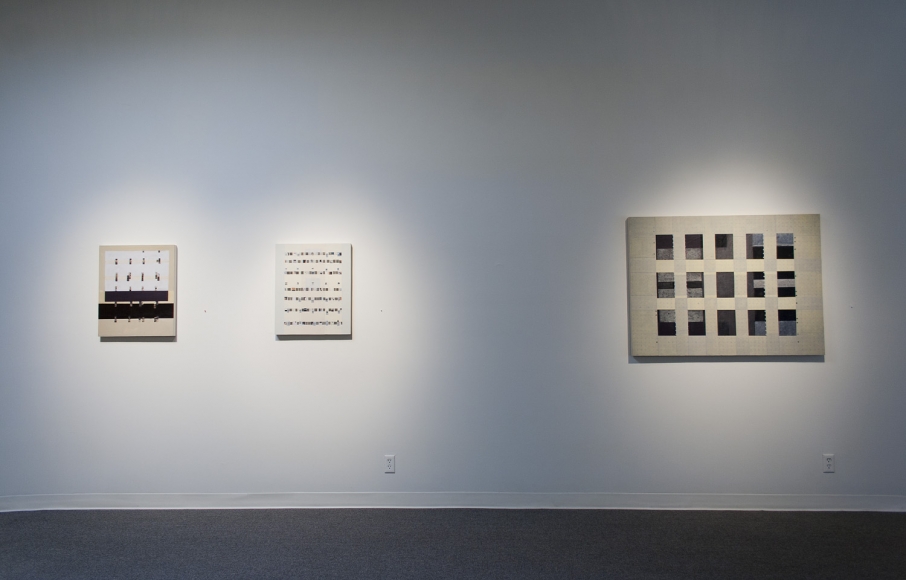
Where is `right edges of canvases`? The width and height of the screenshot is (906, 580). right edges of canvases is located at coordinates (177, 284), (350, 276), (818, 273).